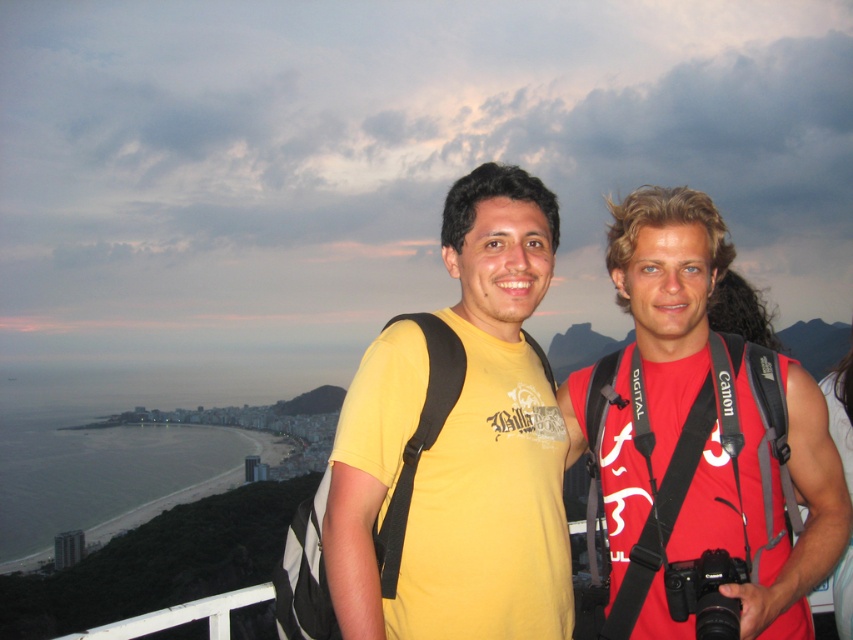
You are a photographer trying to capture a clear image of both the red matte shirt at center and the black plastic camera at center. Since you want both objects to be equally visible in the frame, which object should you adjust your camera settings to compensate for its smaller size?

The black plastic camera at center is smaller in width compared to the red matte shirt at center, so you should adjust your camera settings to compensate for the black plastic camera at center to ensure it appears equally visible in the frame.